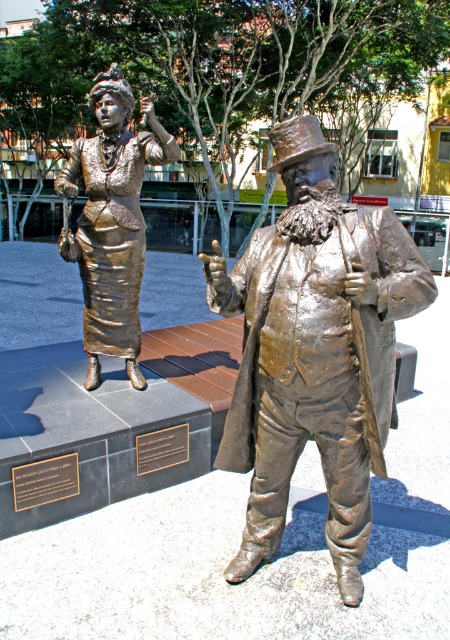
Is point (284, 237) farther from camera compared to point (108, 216)?

No, (284, 237) is in front of (108, 216).

Who is more distant from viewer, (x=363, y=529) or (x=135, y=205)?

The point (x=135, y=205) is more distant.

Find the location of `shiny bronze statue at center`. shiny bronze statue at center is located at coordinates (315, 349).

Is the position of shiny bronze statue at center more distant than that of black polished stone plaque at lower left?

That is False.

The image size is (450, 640). Find the location of `shiny bronze statue at center`. shiny bronze statue at center is located at coordinates (315, 349).

Based on the photo, can you confirm if shiny bronze statue at center is taller than black polished metal plaque at center?

Correct, shiny bronze statue at center is much taller as black polished metal plaque at center.

Based on the photo, between shiny bronze statue at center and black polished metal plaque at center, which one appears on the right side from the viewer's perspective?

Positioned to the right is shiny bronze statue at center.

Who is more distant from viewer, (358,400) or (180,440)?

The point (180,440) is more distant.

In order to click on shiny bronze statue at center in this screenshot , I will do `click(315, 349)`.